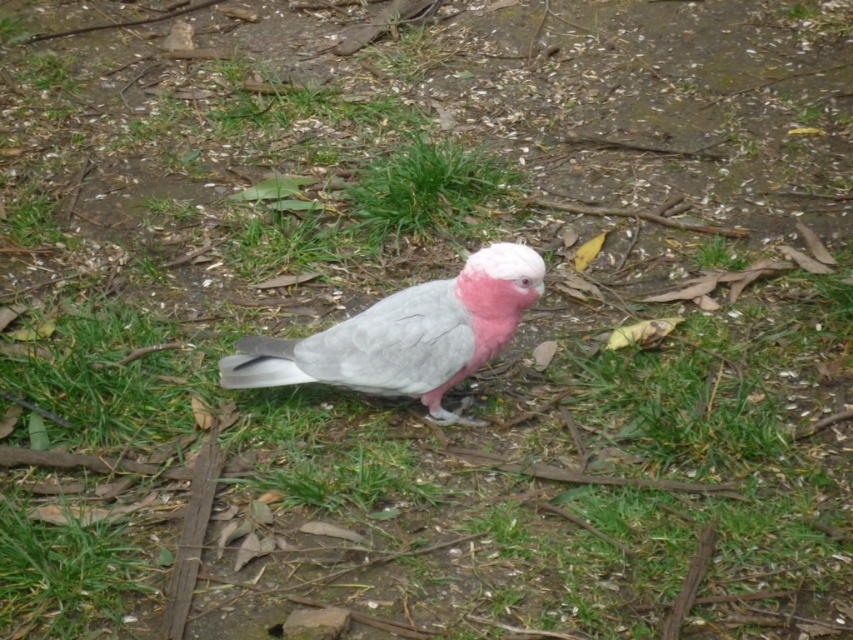
Question: Observing the image, what is the correct spatial positioning of gray matte parrot at center in reference to green leafy grass at center?

Choices:
 (A) below
 (B) above

Answer: (A)

Question: Is gray matte parrot at center to the left of green leafy grass at center from the viewer's perspective?

Choices:
 (A) yes
 (B) no

Answer: (B)

Question: Which of the following is the farthest from the observer?

Choices:
 (A) (451, 348)
 (B) (450, 144)

Answer: (B)

Question: Is gray matte parrot at center bigger than green leafy grass at center?

Choices:
 (A) no
 (B) yes

Answer: (B)

Question: Which point appears farthest from the camera in this image?

Choices:
 (A) (480, 161)
 (B) (488, 282)

Answer: (A)